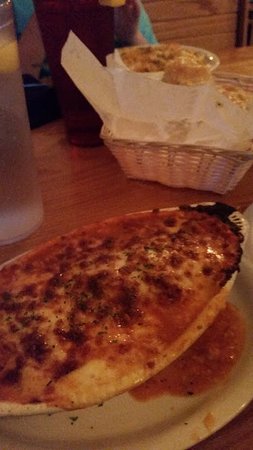
I want to click on basket, so click(213, 169).